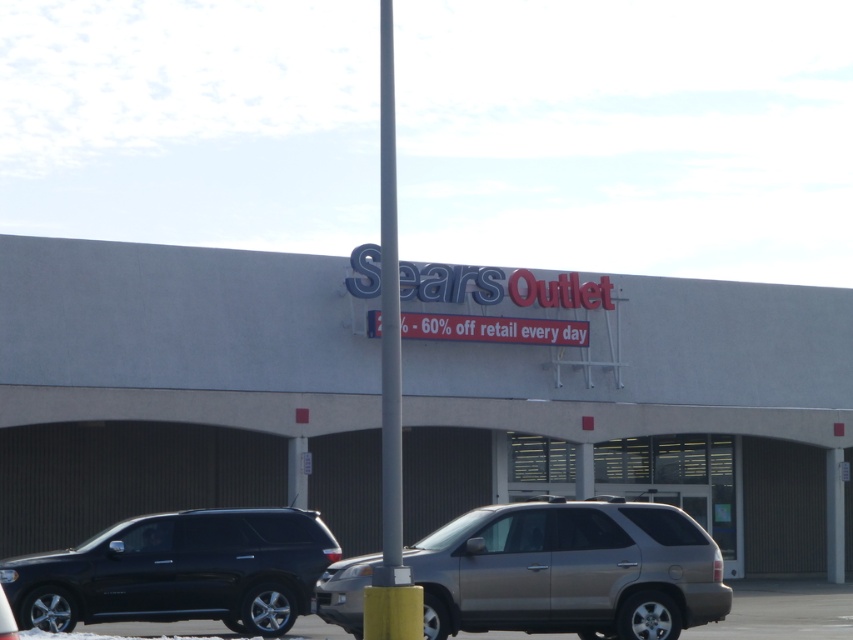
Question: Is shiny black suv at lower left to the right of metallic gray pole at center from the viewer's perspective?

Choices:
 (A) yes
 (B) no

Answer: (A)

Question: Is metallic gray pole at center to the right of metallic gray suv at lower center from the viewer's perspective?

Choices:
 (A) no
 (B) yes

Answer: (A)

Question: Which object is positioned closest to the gray concrete mall at center?

Choices:
 (A) metallic gray pole at center
 (B) metallic gray suv at lower center
 (C) metallic silver minivan at center

Answer: (B)

Question: Is gray concrete mall at center thinner than metallic gray pole at center?

Choices:
 (A) no
 (B) yes

Answer: (A)

Question: Estimate the real-world distances between objects in this image. Which object is closer to the shiny black suv at lower left?

Choices:
 (A) gray concrete mall at center
 (B) metallic gray suv at lower center

Answer: (B)

Question: Based on their relative distances, which object is nearer to the shiny black suv at lower left?

Choices:
 (A) gray concrete mall at center
 (B) metallic gray pole at center
 (C) metallic gray suv at lower center

Answer: (C)